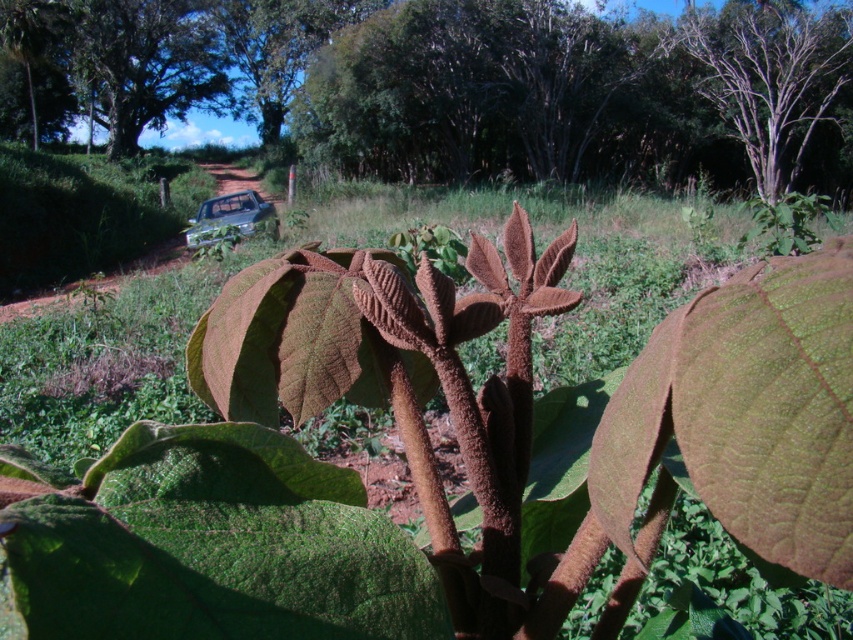
You are standing on the dirt road and see the brown bark tree at upper right and the metallic silver car at center. Which object is positioned to the right side of the other?

The brown bark tree at upper right is to the right of the metallic silver car at center.

Based on the photo, you are standing at the center of the image and want to walk towards the point marked by coordinates point (769, 76). Which direction should you head?

The point (769, 76) corresponds to the brown bark tree at upper right, so you should head towards the upper right direction to reach it.